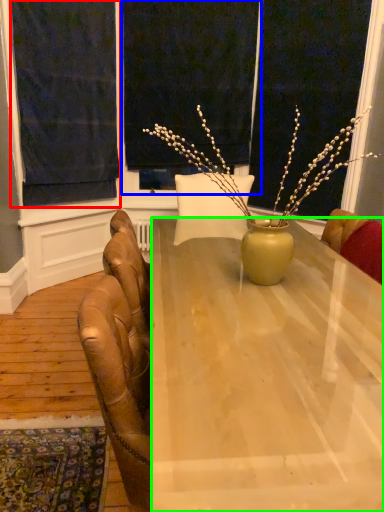
Question: Based on their relative distances, which object is farther from curtain (highlighted by a red box)? Choose from window screen (highlighted by a blue box) and desk (highlighted by a green box).

Choices:
 (A) window screen
 (B) desk

Answer: (B)